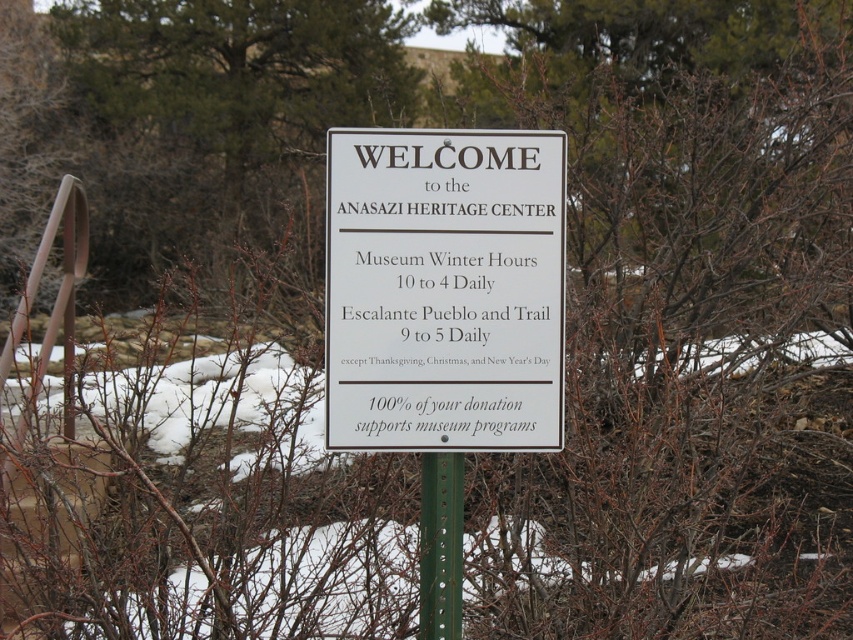
Can you confirm if white plastic sign at center is taller than green metallic post at center?

Yes.

Locate an element on the screen. white plastic sign at center is located at coordinates (444, 289).

Image resolution: width=853 pixels, height=640 pixels. Identify the location of white plastic sign at center. (444, 289).